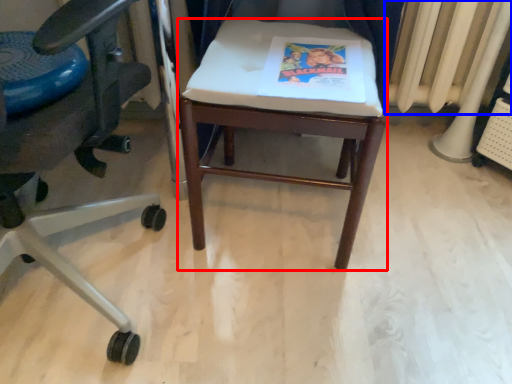
Question: Which object is further to the camera taking this photo, stool (highlighted by a red box) or radiator (highlighted by a blue box)?

Choices:
 (A) stool
 (B) radiator

Answer: (B)